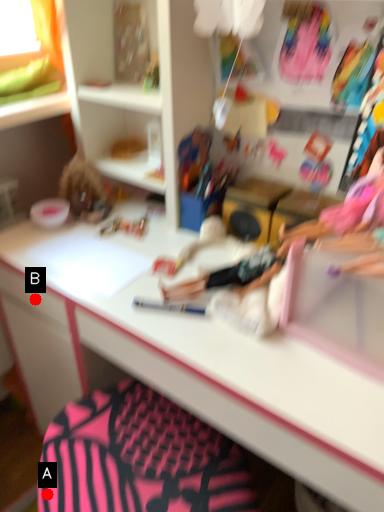
Question: Two points are circled on the image, labeled by A and B beside each circle. Which point is farther from the camera taking this photo?

Choices:
 (A) A is further
 (B) B is further

Answer: (B)